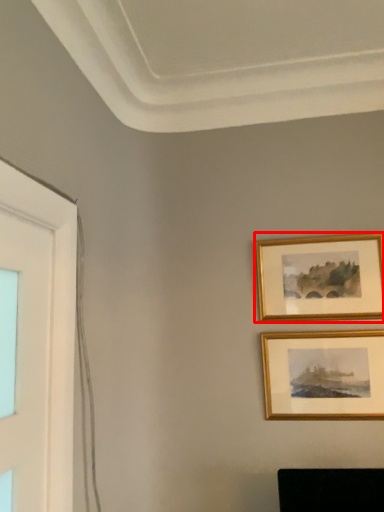
Question: In this image, where is picture frame (annotated by the red box) located relative to picture frame?

Choices:
 (A) left
 (B) right

Answer: (B)